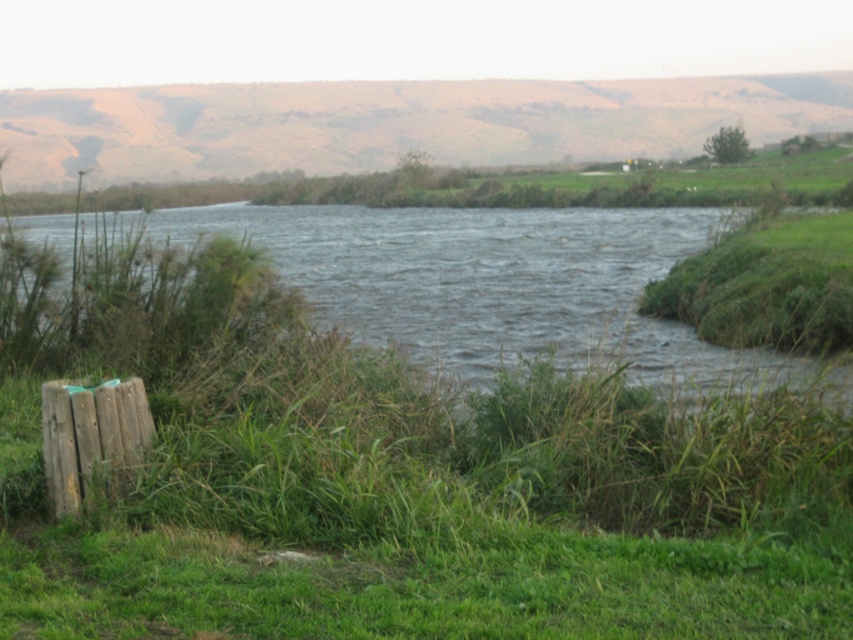
The height and width of the screenshot is (640, 853). I want to click on dark blue water at center, so click(x=492, y=284).

Does point (343, 312) come closer to viewer compared to point (47, 394)?

No, it is behind (47, 394).

The width and height of the screenshot is (853, 640). In order to click on dark blue water at center in this screenshot , I will do (x=492, y=284).